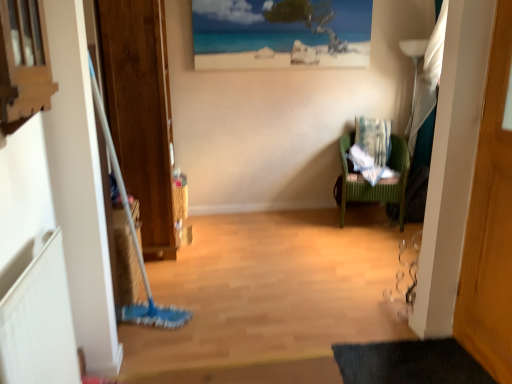
Question: Is beach scene print at upper center bigger or smaller than green plastic chair at right?

Choices:
 (A) big
 (B) small

Answer: (B)

Question: Would you say beach scene print at upper center is to the left or to the right of green plastic chair at right in the picture?

Choices:
 (A) right
 (B) left

Answer: (B)

Question: Considering the real-world distances, which object is farthest from the green plastic chair at right?

Choices:
 (A) patterned fabric laundry at right
 (B) wooden door at right
 (C) beach scene print at upper center
 (D) wooden frame at upper left
 (E) black rubber bath mat at lower right

Answer: (D)

Question: Which object is positioned closest to the black rubber bath mat at lower right?

Choices:
 (A) bamboo picnic basket at center
 (B) white textured radiator at lower left
 (C) beach scene print at upper center
 (D) wooden door at right
 (E) patterned fabric laundry at right

Answer: (D)